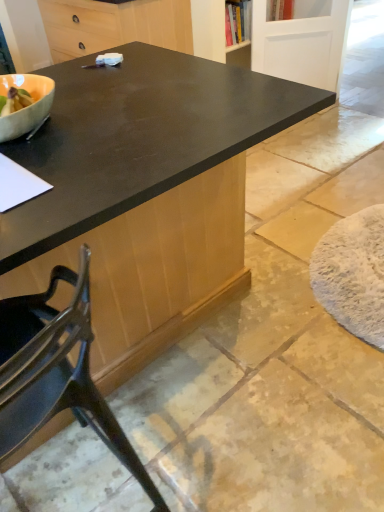
Question: From the image's perspective, is white painted wood screen door at upper right beneath black matte cabinet at upper center?

Choices:
 (A) yes
 (B) no

Answer: (A)

Question: Considering the relative sizes of white painted wood screen door at upper right and black matte cabinet at upper center in the image provided, is white painted wood screen door at upper right thinner than black matte cabinet at upper center?

Choices:
 (A) no
 (B) yes

Answer: (B)

Question: Is black matte cabinet at upper center inside white painted wood screen door at upper right?

Choices:
 (A) no
 (B) yes

Answer: (A)

Question: From the image's perspective, is white painted wood screen door at upper right located above black matte cabinet at upper center?

Choices:
 (A) yes
 (B) no

Answer: (B)

Question: Is white painted wood screen door at upper right behind black matte cabinet at upper center?

Choices:
 (A) yes
 (B) no

Answer: (A)

Question: Looking at the image, does black matte cabinet at upper center seem bigger or smaller compared to white painted wood screen door at upper right?

Choices:
 (A) small
 (B) big

Answer: (B)

Question: Is black matte cabinet at upper center inside the boundaries of white painted wood screen door at upper right, or outside?

Choices:
 (A) inside
 (B) outside

Answer: (B)

Question: Based on their positions, is black matte cabinet at upper center located to the left or right of white painted wood screen door at upper right?

Choices:
 (A) left
 (B) right

Answer: (A)

Question: From a real-world perspective, is black matte cabinet at upper center above or below white painted wood screen door at upper right?

Choices:
 (A) above
 (B) below

Answer: (A)

Question: Does point (41, 385) appear closer or farther from the camera than point (44, 28)?

Choices:
 (A) closer
 (B) farther

Answer: (A)

Question: Looking at their shapes, would you say metallic black chair at lower left is wider or thinner than black matte cabinet at upper center?

Choices:
 (A) wide
 (B) thin

Answer: (B)

Question: Would you say metallic black chair at lower left is to the left or to the right of black matte cabinet at upper center in the picture?

Choices:
 (A) left
 (B) right

Answer: (B)

Question: Choose the correct answer: Is metallic black chair at lower left inside black matte cabinet at upper center or outside it?

Choices:
 (A) outside
 (B) inside

Answer: (A)

Question: Which is correct: black matte cabinet at upper center is inside metallic black chair at lower left, or outside of it?

Choices:
 (A) inside
 (B) outside

Answer: (B)

Question: Considering the positions of black matte cabinet at upper center and metallic black chair at lower left in the image, is black matte cabinet at upper center bigger or smaller than metallic black chair at lower left?

Choices:
 (A) small
 (B) big

Answer: (B)